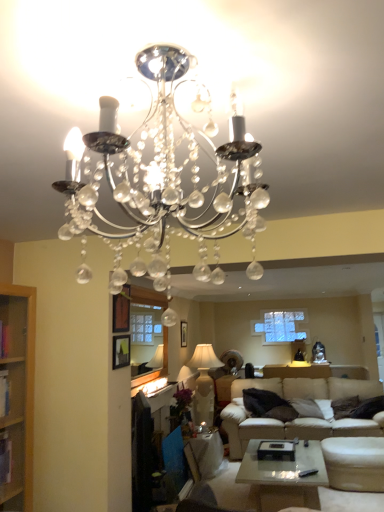
Question: Visually, is clear glass window screen at center positioned to the left or to the right of clear crystal chandelier at upper center, the second lamp from the bottom?

Choices:
 (A) left
 (B) right

Answer: (A)

Question: Looking at their shapes, would you say clear glass window screen at center is wider or thinner than clear crystal chandelier at upper center, acting as the first lamp starting from the top?

Choices:
 (A) thin
 (B) wide

Answer: (A)

Question: Considering the real-world distances, which object is farthest from the clear glass window screen at center?

Choices:
 (A) matte white side table at lower center
 (B) white fabric lampshade at center, arranged as the 2th lamp when viewed from the top
 (C) clear crystal chandelier at upper center, acting as the first lamp starting from the top
 (D) beige fabric couch at lower right

Answer: (C)

Question: Based on their relative distances, which object is farther from the clear glass window screen at center?

Choices:
 (A) clear crystal chandelier at upper center, the second lamp from the bottom
 (B) white fabric lampshade at center, which is counted as the second lamp, starting from the front
 (C) matte white side table at lower center
 (D) beige fabric couch at lower right

Answer: (A)